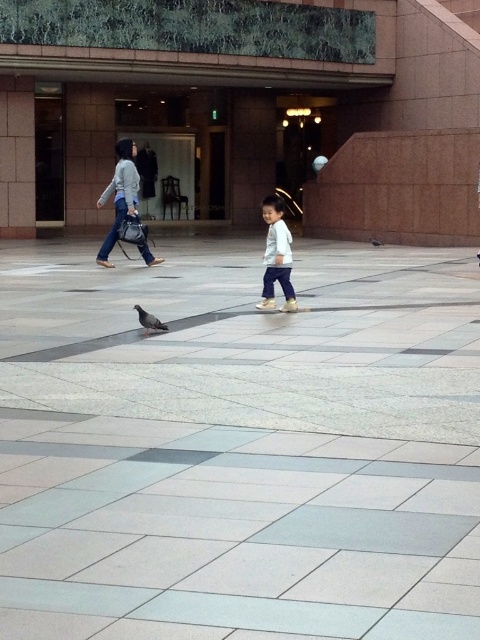
You are standing in the plaza and see the brown marble mall at center and the gray matte pigeon at lower left. Which object is taller?

The brown marble mall at center is taller than the gray matte pigeon at lower left.